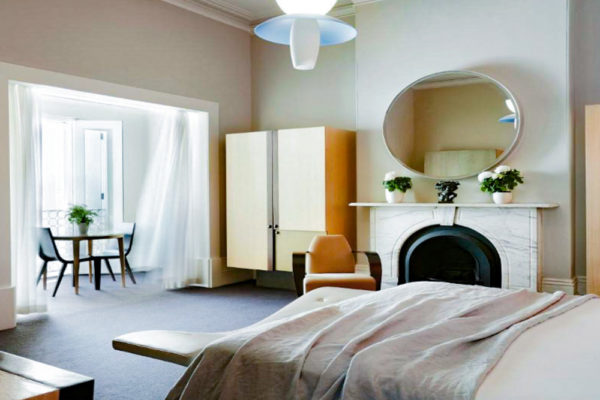
Where is `cabinet`? The height and width of the screenshot is (400, 600). cabinet is located at coordinates (232, 174).